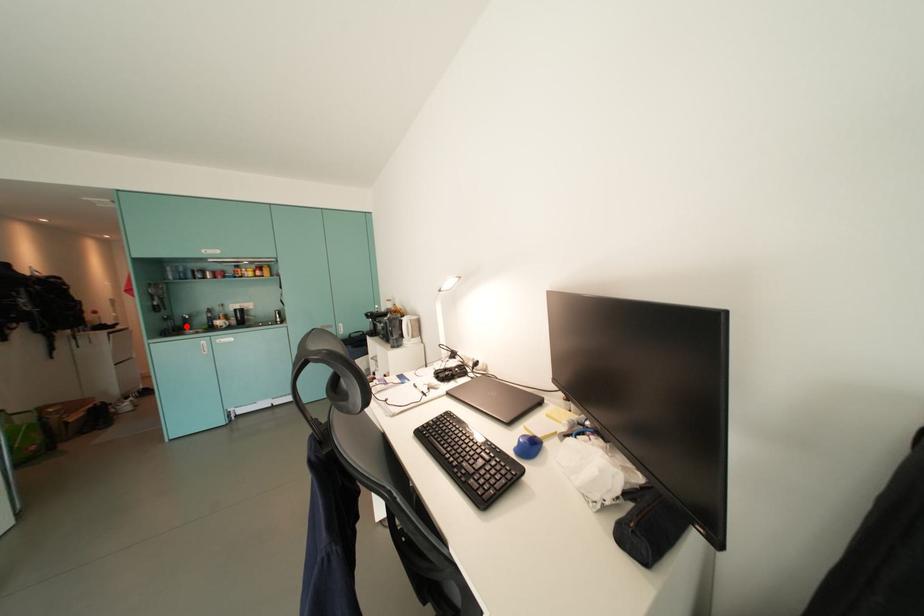
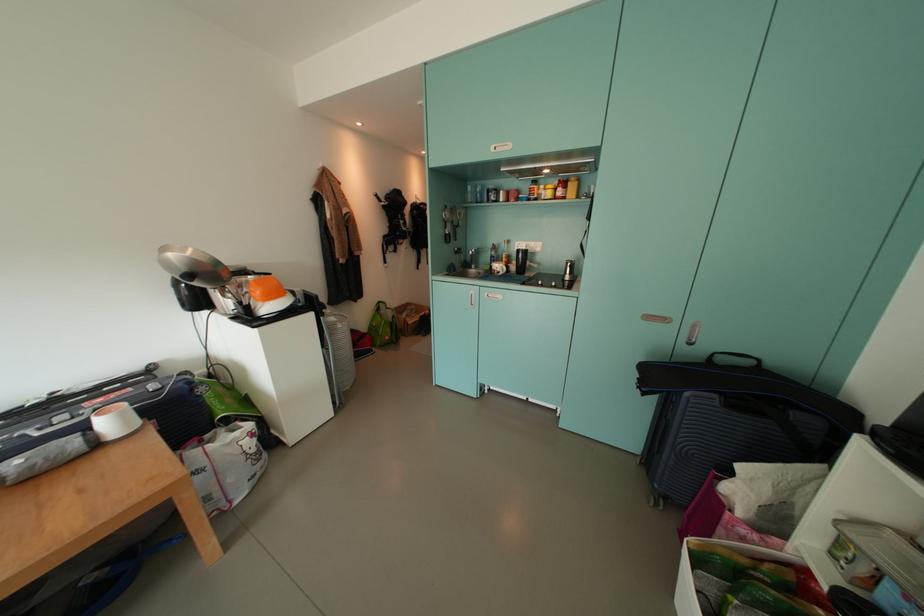
Locate, in the second image, the point that corresponds to the highlighted location in the first image.

(477, 261)